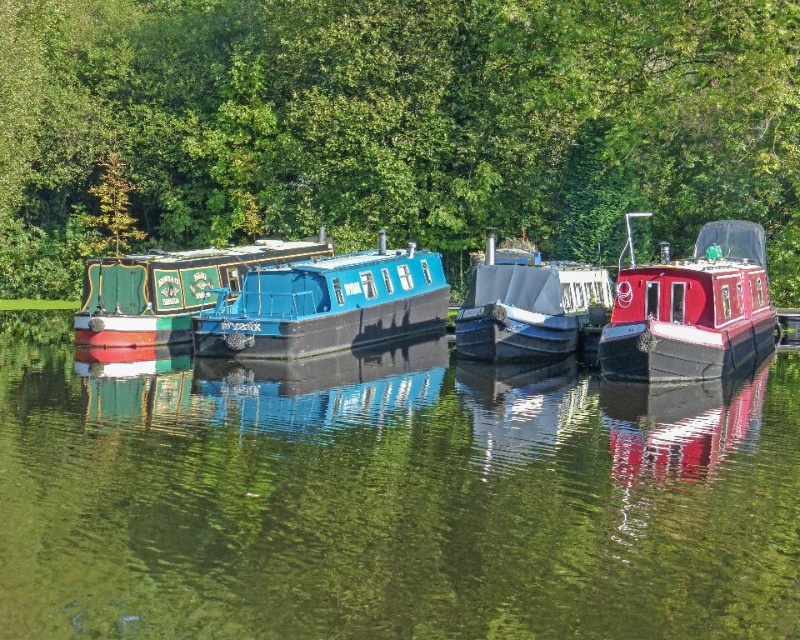
Question: Can you confirm if green leafy tree at upper center is positioned below shiny red boat at right?

Choices:
 (A) yes
 (B) no

Answer: (B)

Question: Which object is the farthest from the green painted wood boat at center?

Choices:
 (A) shiny red boat at right
 (B) green leafy tree at upper center

Answer: (A)

Question: Which of the following is the closest to the observer?

Choices:
 (A) (612, 360)
 (B) (276, 564)
 (C) (168, 333)

Answer: (B)

Question: Which object is the closest to the green reflective water at center?

Choices:
 (A) green leafy tree at upper center
 (B) matte gray cabin cruiser at center

Answer: (B)

Question: Is shiny red boat at right smaller than blue glossy canal boat at center?

Choices:
 (A) yes
 (B) no

Answer: (B)

Question: In this image, where is green leafy tree at upper center located relative to green painted wood boat at center?

Choices:
 (A) above
 (B) below

Answer: (A)